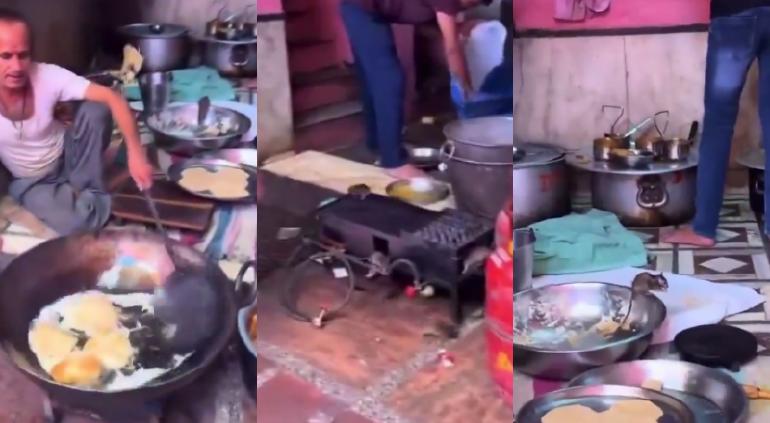
Find the location of a particular element. The width and height of the screenshot is (770, 423). hot plate is located at coordinates (393, 238).